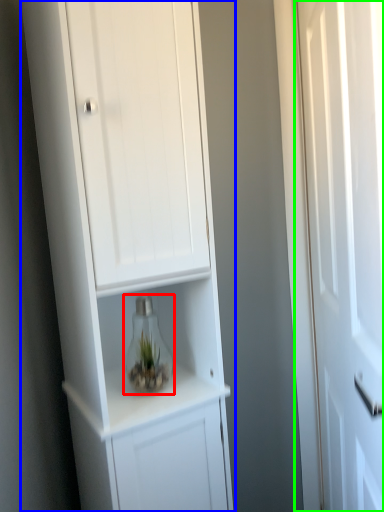
Question: Considering the real-world distances, which object is farthest from glass vase (highlighted by a red box)? cupboard (highlighted by a blue box) or door (highlighted by a green box)?

Choices:
 (A) cupboard
 (B) door

Answer: (B)